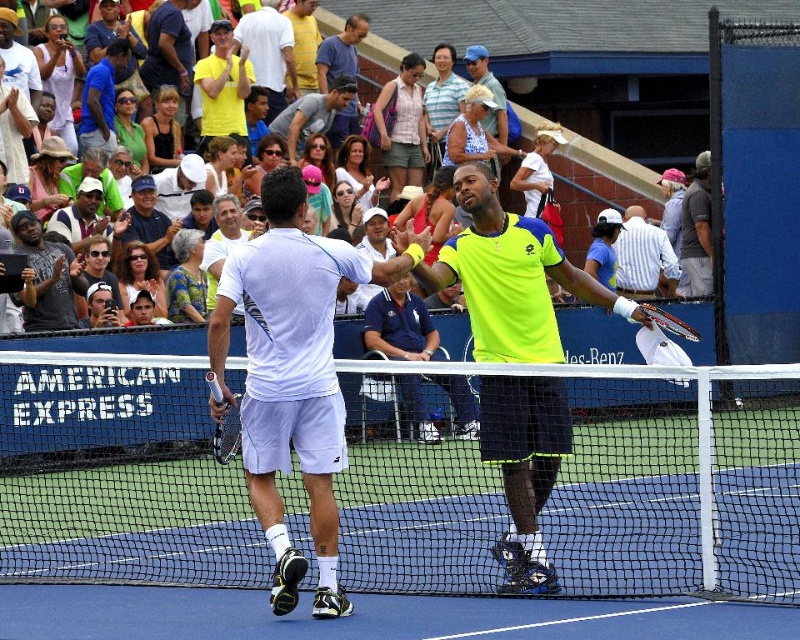
You are a photographer at the tennis court and want to capture a photo of the neon yellow fabric shirt at center and the white matte tennis racket at center. Which object should you focus on first if you want to ensure both are in focus, considering their sizes?

The neon yellow fabric shirt at center is much taller than the white matte tennis racket at center, so you should focus on the neon yellow fabric shirt at center first to ensure both are in focus.

You are a photographer at the tennis match and want to capture a photo of the white cotton shirt at upper center and the white matte tennis racket at center. Based on their positions, which object is located to the left of the other?

The white cotton shirt at upper center is positioned on the left side of white matte tennis racket at center.

Consider the image. You are a photographer at the tennis match and want to capture a photo where both the white cotton shirt at upper center and the white matte tennis racket at center are visible. Based on their sizes, which object will appear larger in the photo?

The white cotton shirt at upper center will appear larger in the photo because it is taller than the white matte tennis racket at center.